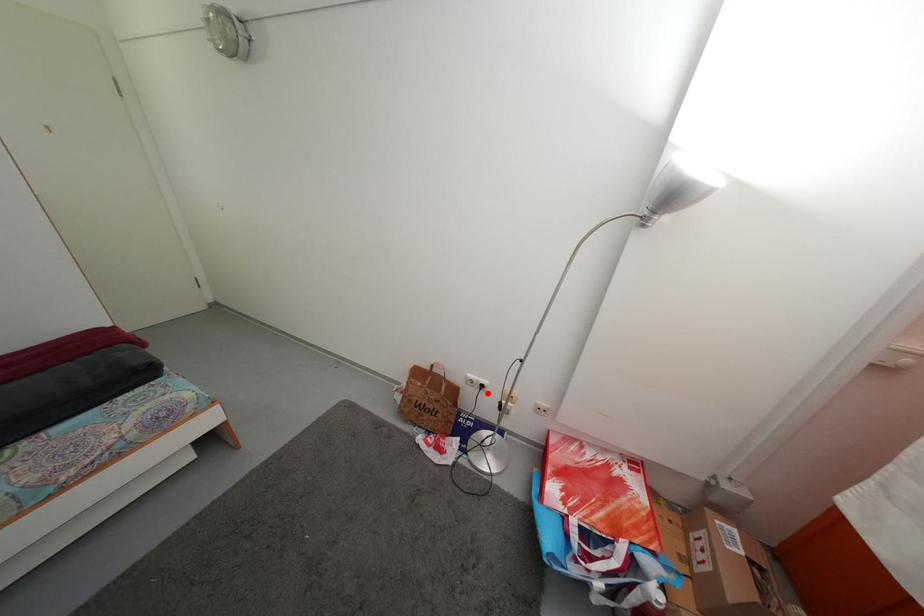
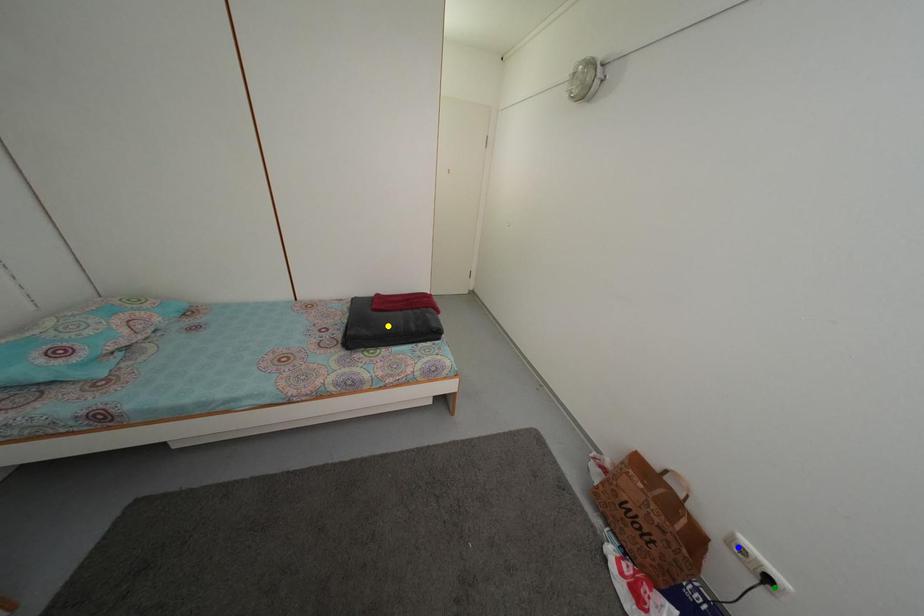
Question: I am providing you with two images of the same scene from different viewpoints. A red point is marked on the first image. You are given multiple points on the second image. Which point in image 2 represents the same 3d spot as the red point in image 1?

Choices:
 (A) green point
 (B) blue point
 (C) yellow point

Answer: (A)